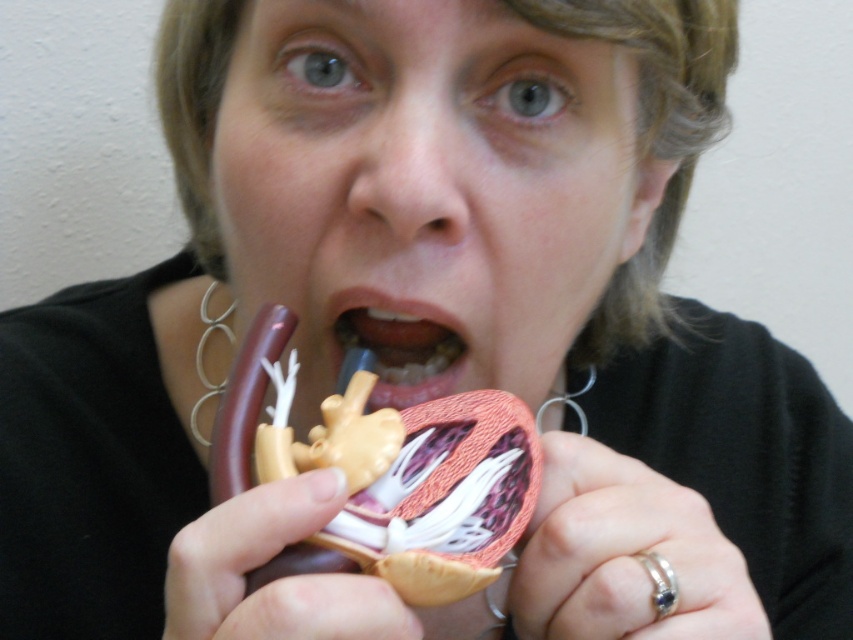
Question: Among these points, which one is farthest from the camera?

Choices:
 (A) (392, 360)
 (B) (483, 568)

Answer: (A)

Question: Which point is closer to the camera?

Choices:
 (A) (380, 356)
 (B) (407, 474)

Answer: (B)

Question: Does smooth plastic heart at center have a larger size compared to pink matte heart at center?

Choices:
 (A) no
 (B) yes

Answer: (B)

Question: Can you confirm if smooth plastic heart at center is thinner than pink matte heart at center?

Choices:
 (A) yes
 (B) no

Answer: (B)

Question: Is smooth plastic heart at center bigger than pink matte heart at center?

Choices:
 (A) no
 (B) yes

Answer: (B)